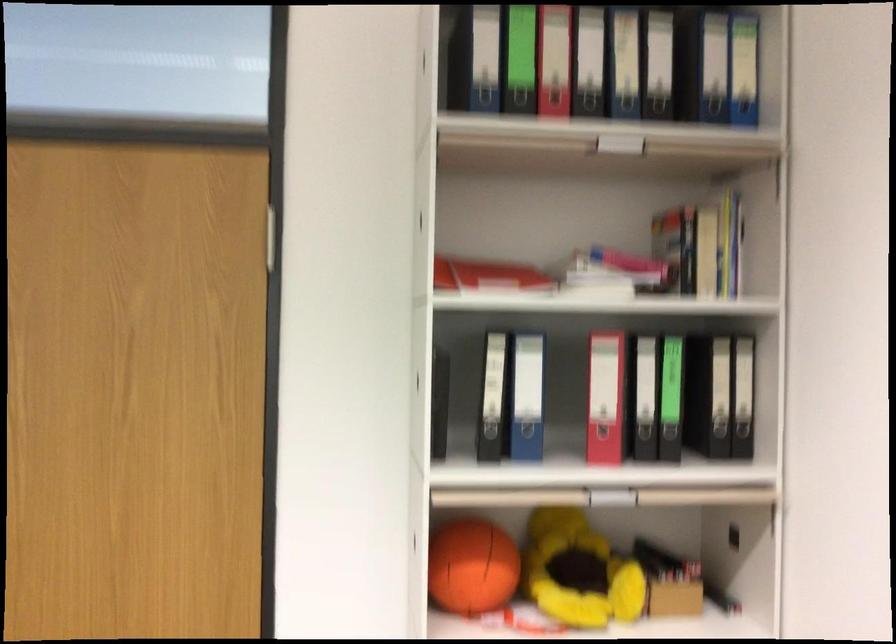
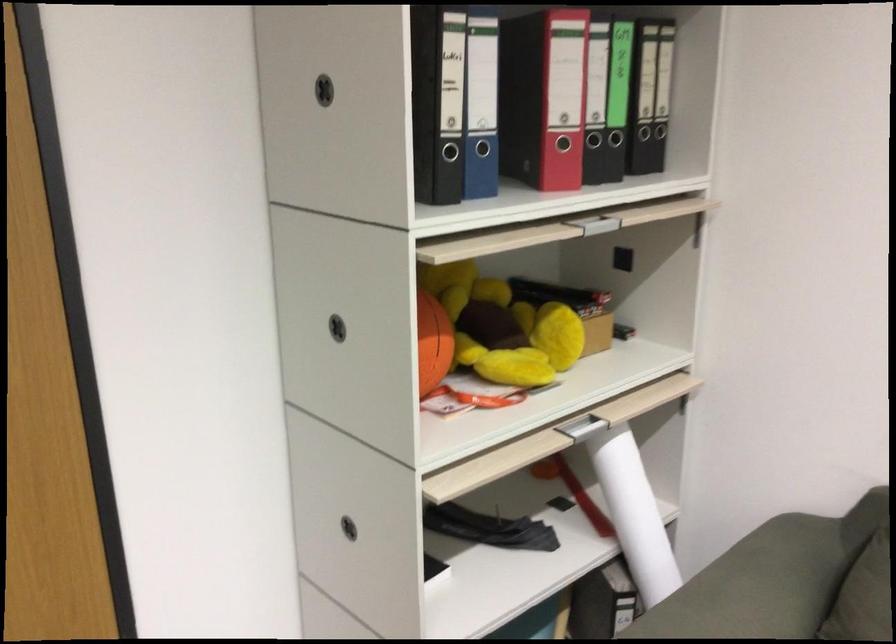
First-person continuous shooting, in which direction is the camera rotating?

The camera's rotation is toward right-down.